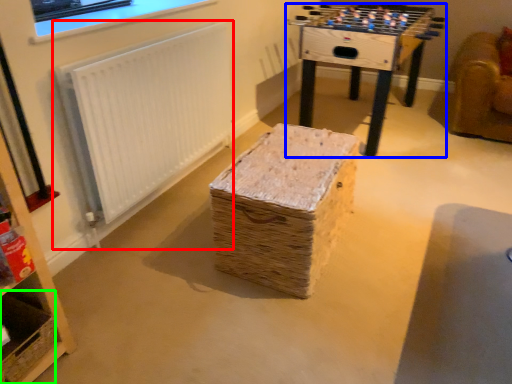
Question: Considering the real-world distances, which object is farthest from radiator (highlighted by a red box)? table (highlighted by a blue box) or basket (highlighted by a green box)?

Choices:
 (A) table
 (B) basket

Answer: (A)